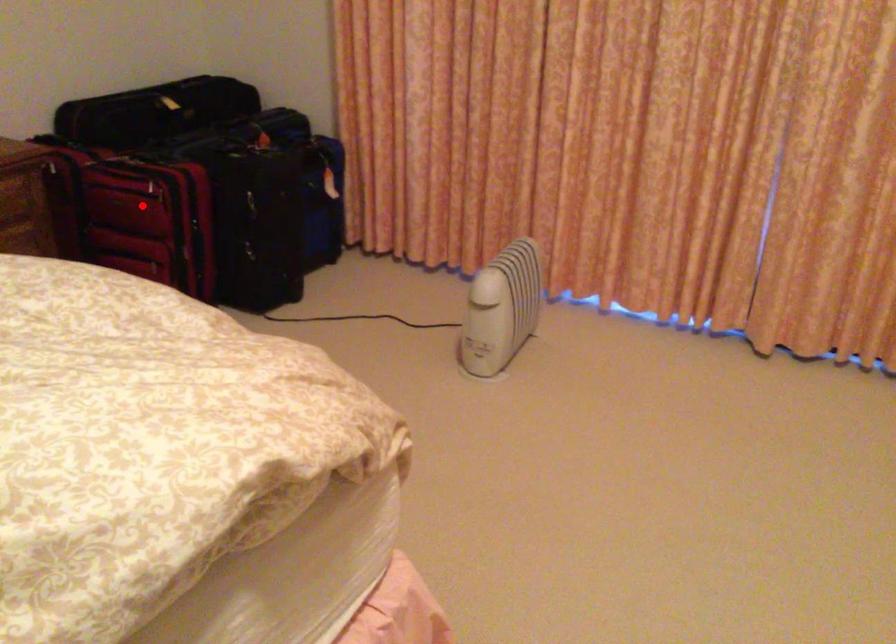
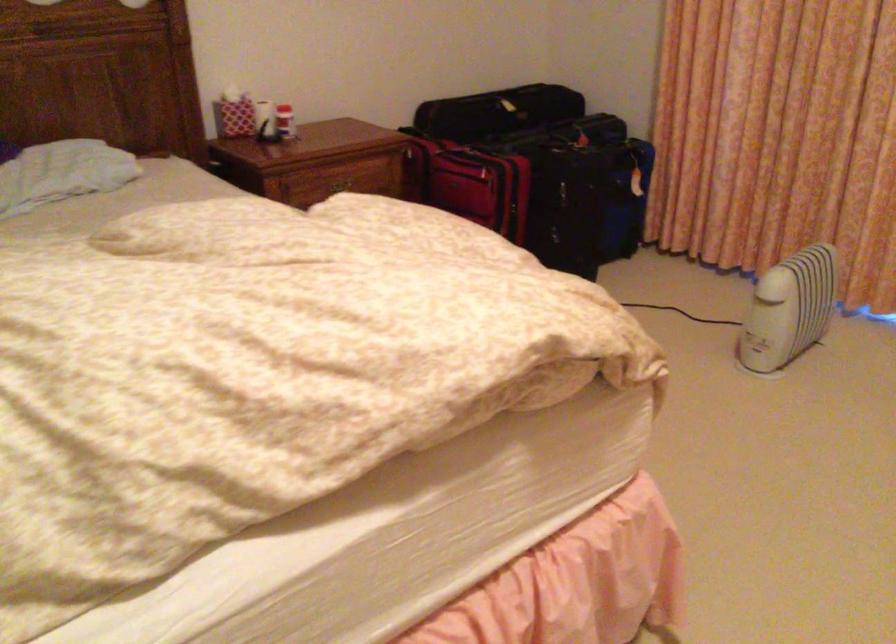
Locate, in the second image, the point that corresponds to the highlighted location in the first image.

(469, 183)